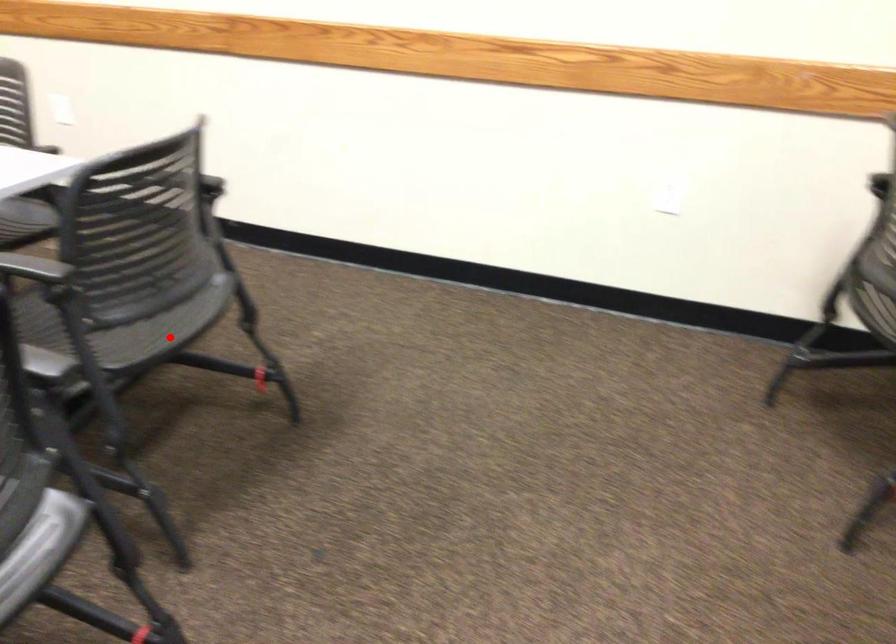
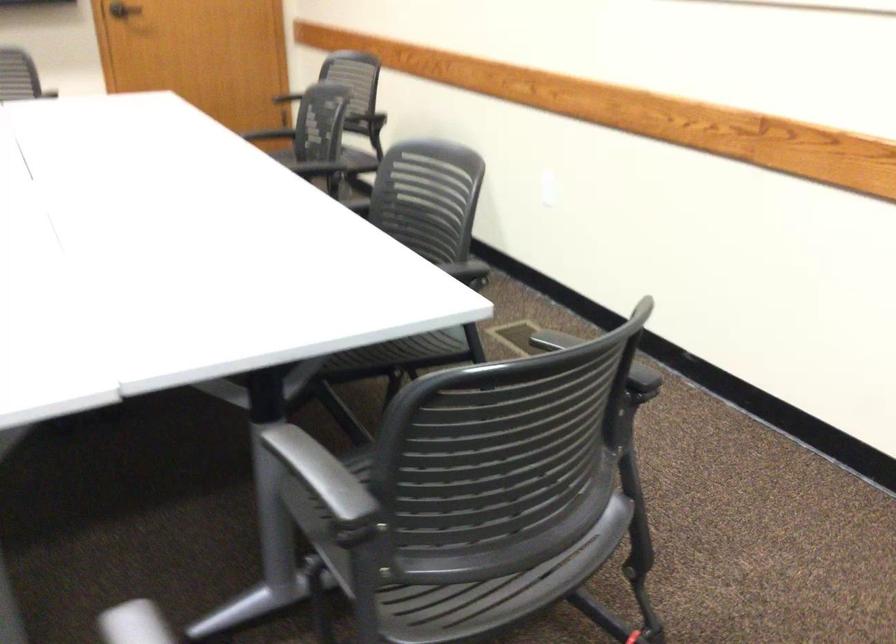
Question: A red point is marked in image1. In image2, is the corresponding 3D point closer to the camera or farther? Reply with the corresponding letter.

Choices:
 (A) The corresponding 3D point is closer.
 (B) The corresponding 3D point is farther.

Answer: (A)